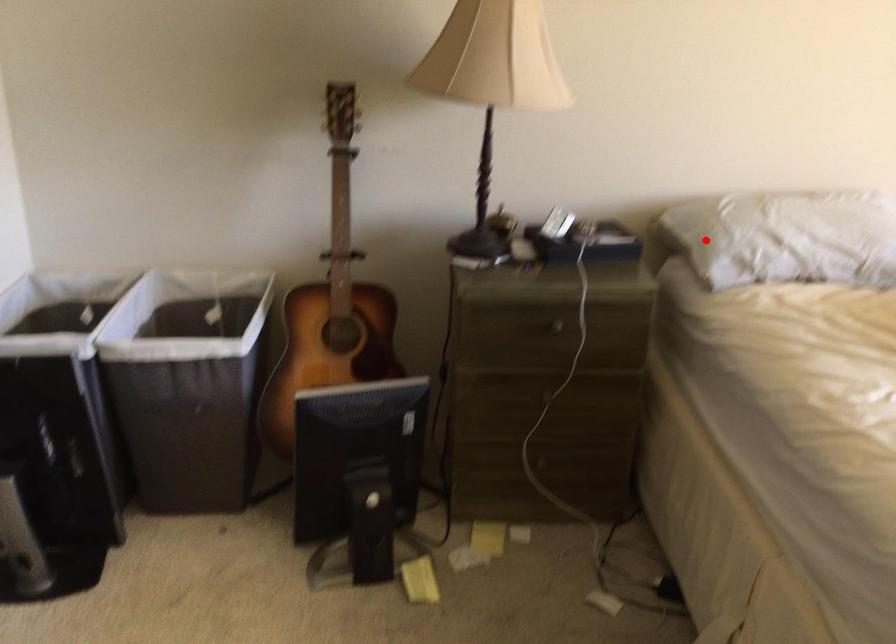
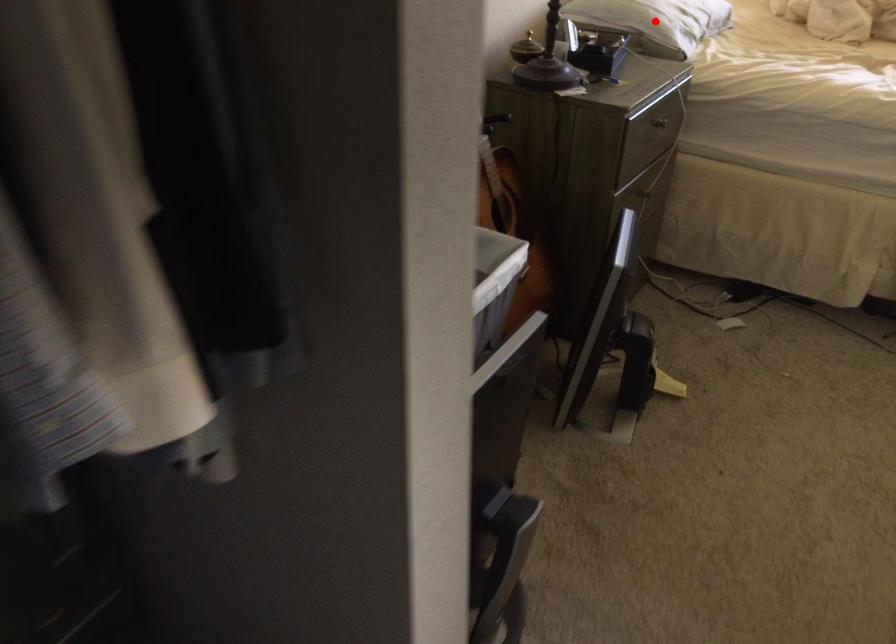
I am providing you with two images of the same scene from different viewpoints. A red point is marked on the first image and another point is marked on the second image. Is the marked point in image1 the same physical position as the marked point in image2?

Yes